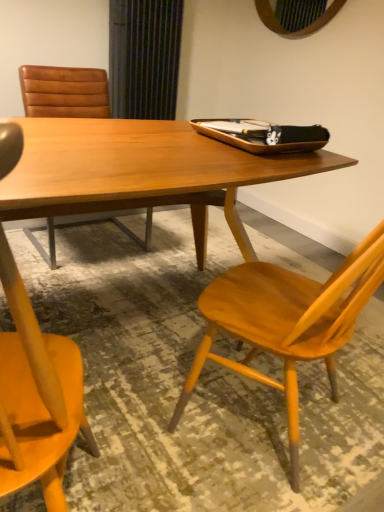
Question: Is wooden chair at right, the second chair in the back-to-front sequence, looking in the opposite direction of brown leather chair at upper left, the 1th chair positioned from the back?

Choices:
 (A) no
 (B) yes

Answer: (A)

Question: From the image's perspective, is wooden chair at right, the 1th chair viewed from the right, located beneath brown leather chair at upper left, which is the 1th chair in left-to-right order?

Choices:
 (A) no
 (B) yes

Answer: (B)

Question: Is wooden chair at right, which is the 1th chair from front to back, facing towards brown leather chair at upper left, which appears as the second chair when viewed from the front?

Choices:
 (A) no
 (B) yes

Answer: (B)

Question: Considering the relative positions of wooden chair at right, which appears as the 2th chair when viewed from the left, and brown leather chair at upper left, which is the 1th chair in left-to-right order, in the image provided, is wooden chair at right, which appears as the 2th chair when viewed from the left, to the left of brown leather chair at upper left, which is the 1th chair in left-to-right order, from the viewer's perspective?

Choices:
 (A) no
 (B) yes

Answer: (A)

Question: Is brown leather chair at upper left, the 1th chair positioned from the back, located within wooden chair at right, which is the 1th chair from front to back?

Choices:
 (A) no
 (B) yes

Answer: (A)

Question: Can you confirm if wooden chair at right, which appears as the 2th chair when viewed from the left, is shorter than brown leather chair at upper left, which appears as the second chair when viewed from the front?

Choices:
 (A) no
 (B) yes

Answer: (A)

Question: Is the depth of brown leather chair at upper left, which appears as the second chair when viewed from the front, greater than that of wooden chair at right, which appears as the 2th chair when viewed from the left?

Choices:
 (A) yes
 (B) no

Answer: (A)

Question: Considering the relative sizes of brown leather chair at upper left, which is the 1th chair in left-to-right order, and wooden chair at right, the 1th chair viewed from the right, in the image provided, is brown leather chair at upper left, which is the 1th chair in left-to-right order, thinner than wooden chair at right, the 1th chair viewed from the right,?

Choices:
 (A) yes
 (B) no

Answer: (B)

Question: Does brown leather chair at upper left, the 1th chair positioned from the back, have a smaller size compared to wooden chair at right, the second chair in the back-to-front sequence?

Choices:
 (A) yes
 (B) no

Answer: (B)

Question: Considering the relative sizes of brown leather chair at upper left, the 1th chair positioned from the back, and wooden chair at right, the second chair in the back-to-front sequence, in the image provided, is brown leather chair at upper left, the 1th chair positioned from the back, wider than wooden chair at right, the second chair in the back-to-front sequence,?

Choices:
 (A) no
 (B) yes

Answer: (B)

Question: Considering the relative sizes of brown leather chair at upper left, which appears as the second chair when viewed from the front, and wooden chair at right, the 1th chair viewed from the right, in the image provided, is brown leather chair at upper left, which appears as the second chair when viewed from the front, shorter than wooden chair at right, the 1th chair viewed from the right,?

Choices:
 (A) yes
 (B) no

Answer: (A)

Question: From the image's perspective, is brown leather chair at upper left, the 1th chair positioned from the back, above wooden chair at right, which appears as the 2th chair when viewed from the left?

Choices:
 (A) yes
 (B) no

Answer: (A)

Question: From a real-world perspective, is wooden table at center located beneath brown leather chair at upper left, acting as the second chair starting from the right?

Choices:
 (A) yes
 (B) no

Answer: (A)